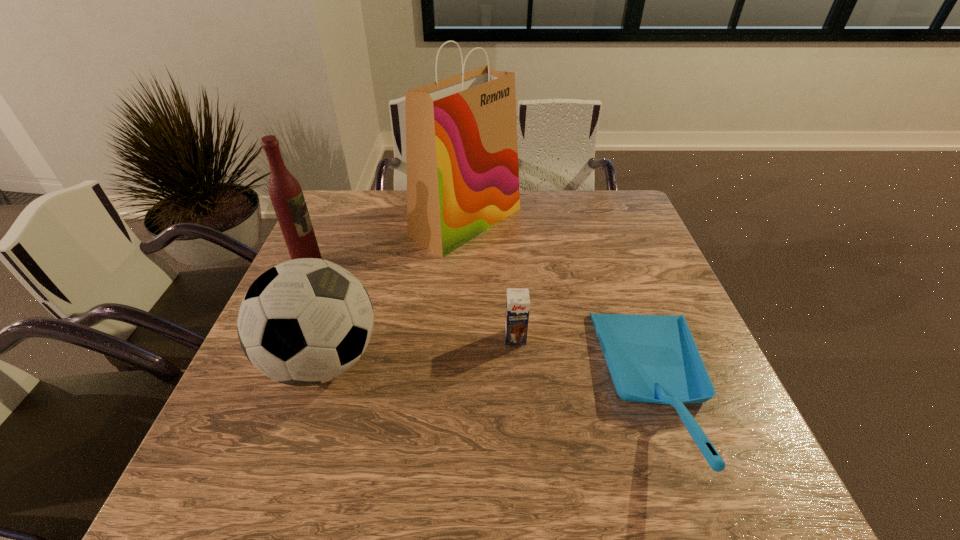
Where is `vacant space in between the soccer ball and the dustpan`? The width and height of the screenshot is (960, 540). vacant space in between the soccer ball and the dustpan is located at coordinates click(x=492, y=376).

The height and width of the screenshot is (540, 960). In order to click on unoccupied area between the tallest object and the third tallest object in this screenshot , I will do `click(395, 292)`.

Image resolution: width=960 pixels, height=540 pixels. I want to click on vacant space in between the shopping bag and the rightmost object, so click(564, 307).

Select which object appears as the second closest to the fourth shortest object. Please provide its 2D coordinates. Your answer should be formatted as a tuple, i.e. [(x, y)], where the tuple contains the x and y coordinates of a point satisfying the conditions above.

[(461, 132)]

This screenshot has height=540, width=960. I want to click on object that can be found as the third closest to the shopping bag, so click(651, 358).

You are a GUI agent. You are given a task and a screenshot of the screen. Output one action in this format:
    pyautogui.click(x=<x>, y=<y>)
    Task: Click on the free region that satisfies the following two spatial constraints: 1. on the label of the dustpan; 2. on the left side of the second farthest object
    
    Given the screenshot: What is the action you would take?
    pyautogui.click(x=252, y=392)

The width and height of the screenshot is (960, 540). In order to click on free space that satisfies the following two spatial constraints: 1. on the label of the fourth nearest object; 2. on the back side of the rightmost object in this screenshot , I will do `click(252, 392)`.